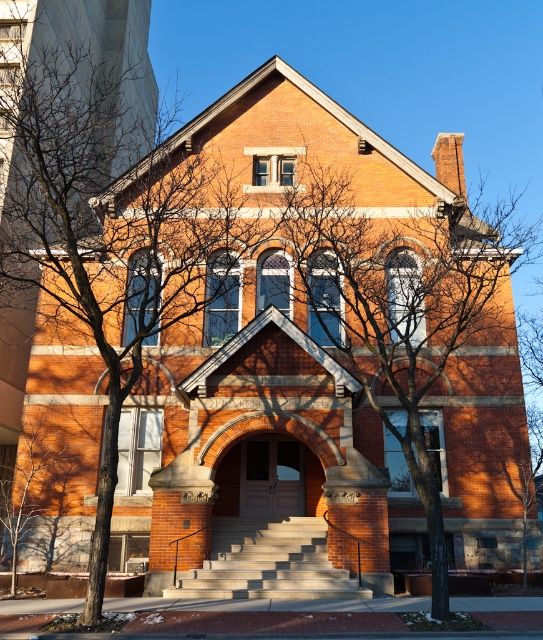
You are a window washer standing on the light gray concrete stairs at center. You notice some bare branches at center that are blocking your view. Can you reach them with a 4 meter long pole?

The distance between the bare branches at center and the light gray concrete stairs at center is 4.36 meters. Since the pole is only 4 meters long, you cannot reach the bare branches at center with it.

You are standing in front of the historic brick building and want to enter through the central entrance. There are bare branches at center and light gray concrete stairs at center. Which object is located higher relative to the other?

The bare branches at center are located above the light gray concrete stairs at center.